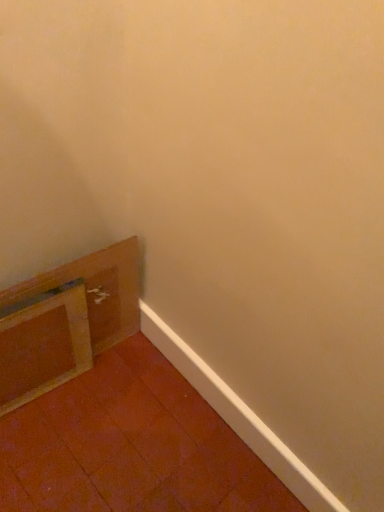
Image resolution: width=384 pixels, height=512 pixels. I want to click on brown cardboard box at lower left, so click(98, 290).

This screenshot has height=512, width=384. What do you see at coordinates (98, 290) in the screenshot?
I see `brown cardboard box at lower left` at bounding box center [98, 290].

Identify the location of brown cardboard box at lower left. (98, 290).